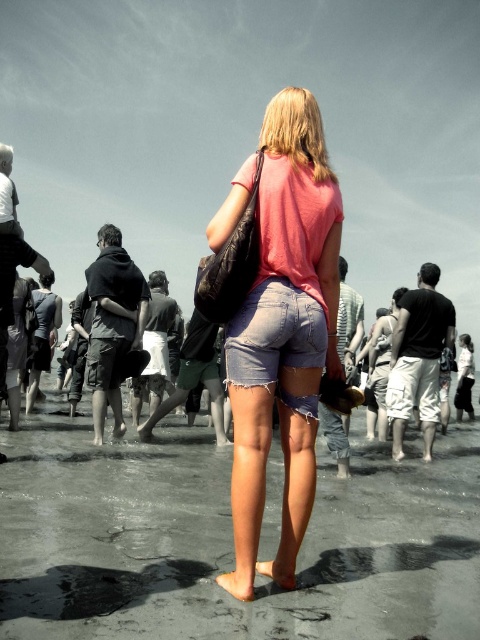
Question: In this image, where is ripped denim shorts at center located relative to pink denim shorts at center?

Choices:
 (A) above
 (B) below

Answer: (B)

Question: Which object is closer to the camera taking this photo?

Choices:
 (A) ripped denim shorts at center
 (B) pink denim shorts at center

Answer: (B)

Question: Does ripped denim shorts at center have a larger size compared to pink denim shorts at center?

Choices:
 (A) yes
 (B) no

Answer: (B)

Question: Is ripped denim shorts at center below pink denim shorts at center?

Choices:
 (A) yes
 (B) no

Answer: (A)

Question: Which object appears farthest from the camera in this image?

Choices:
 (A) ripped denim shorts at center
 (B) pink denim shorts at center

Answer: (A)

Question: Which of the following is the closest to the observer?

Choices:
 (A) pink denim shorts at center
 (B) ripped denim shorts at center

Answer: (A)